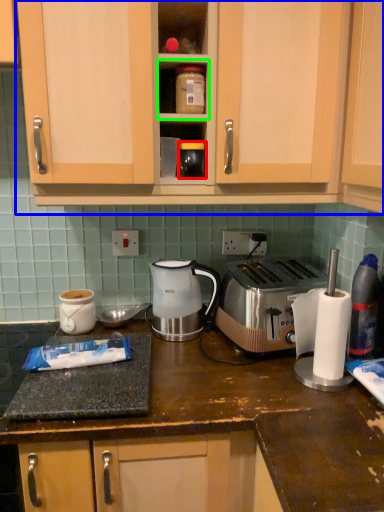
Question: Which is nearer to the appliance (highlighted by a red box)? cabinetry (highlighted by a blue box) or shelf (highlighted by a green box).

Choices:
 (A) cabinetry
 (B) shelf

Answer: (B)